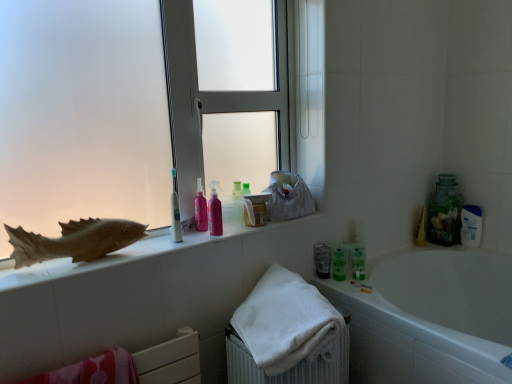
Question: Considering the positions of white glossy bathtub at lower right and clear glass jar at upper right in the image, is white glossy bathtub at lower right taller or shorter than clear glass jar at upper right?

Choices:
 (A) short
 (B) tall

Answer: (B)

Question: Is white glossy bathtub at lower right bigger or smaller than clear glass jar at upper right?

Choices:
 (A) small
 (B) big

Answer: (B)

Question: Which object is positioned farthest from the white glossy bathtub at lower right?

Choices:
 (A) green matte tube at center, which ranks as the second mouthwash in left-to-right order
 (B) pink glossy lotion at center, arranged as the first toiletry when viewed from the front
 (C) white plastic toothbrush at center
 (D) green matte mouthwash at lower right, marked as the 2th mouthwash in a back-to-front arrangement
 (E) clear glass jar at upper right

Answer: (C)

Question: Which object is positioned farthest from the white textured towel at lower center?

Choices:
 (A) green matte mouthwash at lower right, marked as the 3th mouthwash in a left-to-right arrangement
 (B) brown matte fish at left
 (C) white glossy bathtub at lower right
 (D) frosted glass window at upper center
 (E) matte plastic fish at left

Answer: (B)